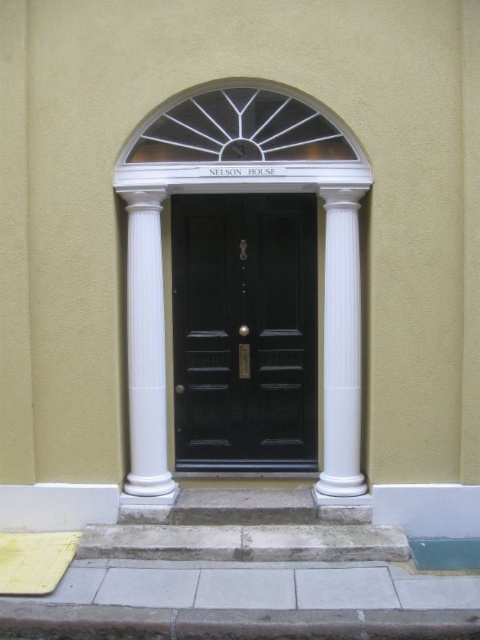
You are standing at the entrance of Nelson House and want to find the white glossy column at center. Based on the coordinates provided, can you determine its position relative to the entrance?

The white glossy column at center is located at coordinates point (145, 353), which places it centrally positioned within the entrance area.

You are a delivery person holding a large package that is 1.2 meters wide. You need to enter Nelson House through the entrance shown. Can the package fit through the matte black door at center if the white smooth column at center is 0.5 meters wide?

The matte black door at center is wider than the white smooth column at center, which is 0.5 meters wide. Since the door is wider, the 1.2 meters wide package might fit, but the exact width of the door isn